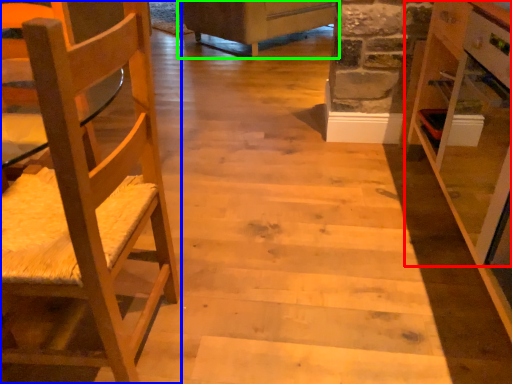
Question: Estimate the real-world distances between objects in this image. Which object is closer to cabinetry (highlighted by a red box), chair (highlighted by a blue box) or furniture (highlighted by a green box)?

Choices:
 (A) chair
 (B) furniture

Answer: (A)